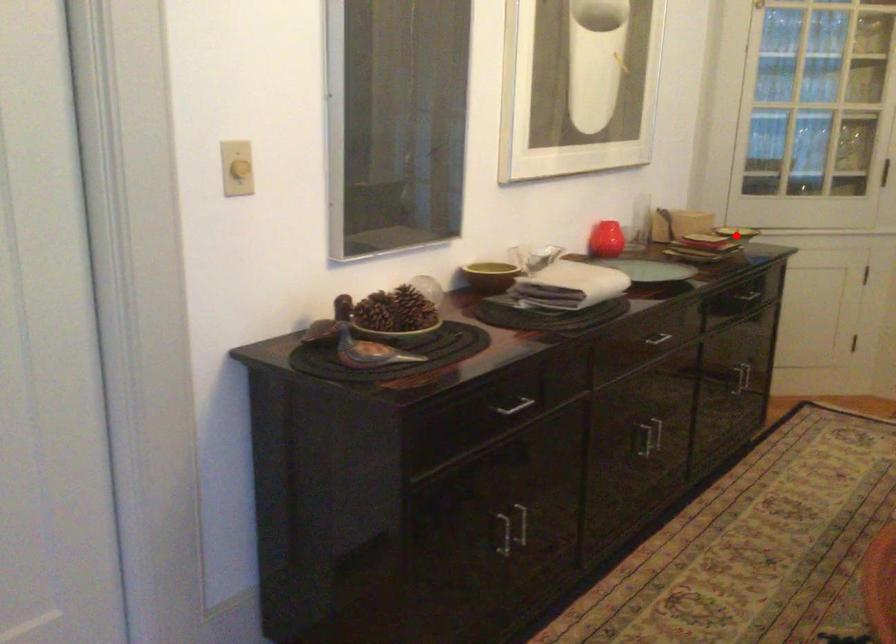
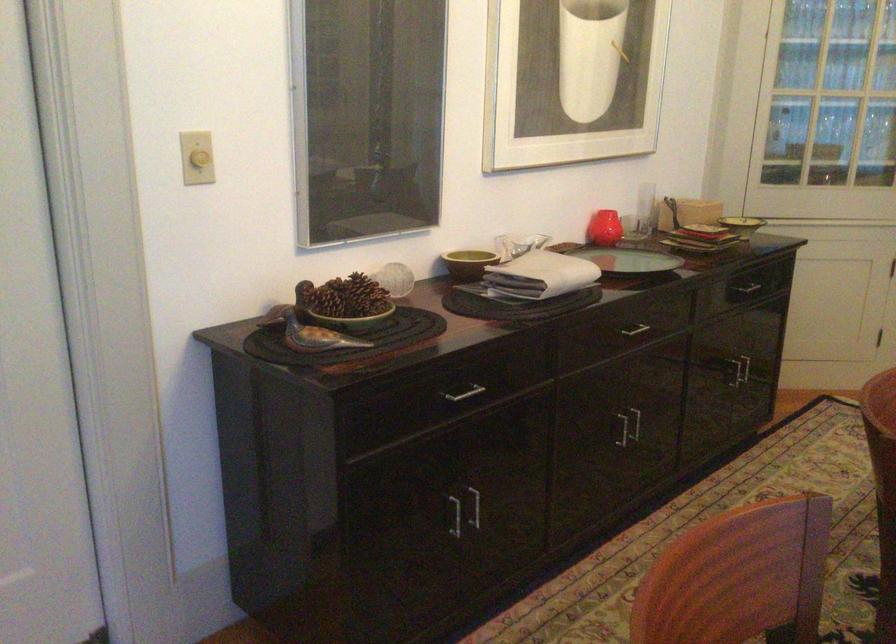
In the second image, find the point that corresponds to the highlighted location in the first image.

(742, 225)